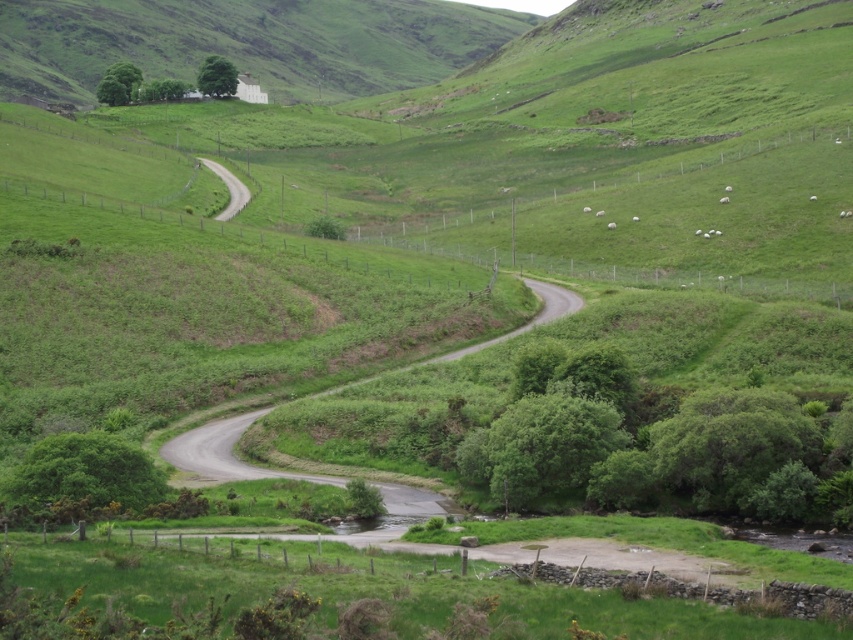
Is green grassy hillside at upper center behind gray asphalt road at center?

That is True.

Is green grassy hillside at upper center taller than gray asphalt road at center?

Yes.

What are the coordinates of `green grassy hillside at upper center` in the screenshot? It's located at (247, 42).

Locate an element on the screen. Image resolution: width=853 pixels, height=640 pixels. green grassy hillside at upper center is located at coordinates (x=247, y=42).

Can you confirm if green grassy hillside at upper center is positioned above white woolly sheep at center?

Correct, green grassy hillside at upper center is located above white woolly sheep at center.

From the picture: Does green grassy hillside at upper center appear on the right side of white woolly sheep at center?

No, green grassy hillside at upper center is not to the right of white woolly sheep at center.

Who is more forward, (49, 33) or (611, 225)?

Point (611, 225) is more forward.

The width and height of the screenshot is (853, 640). Identify the location of green grassy hillside at upper center. (247, 42).

Does gray asphalt road at center appear on the left side of white woolly sheep at center?

Correct, you'll find gray asphalt road at center to the left of white woolly sheep at center.

Who is shorter, gray asphalt road at center or white woolly sheep at center?

Standing shorter between the two is white woolly sheep at center.

Is point (234, 468) positioned before point (611, 227)?

Yes, point (234, 468) is closer to viewer.

Find the location of a particular element. gray asphalt road at center is located at coordinates (224, 452).